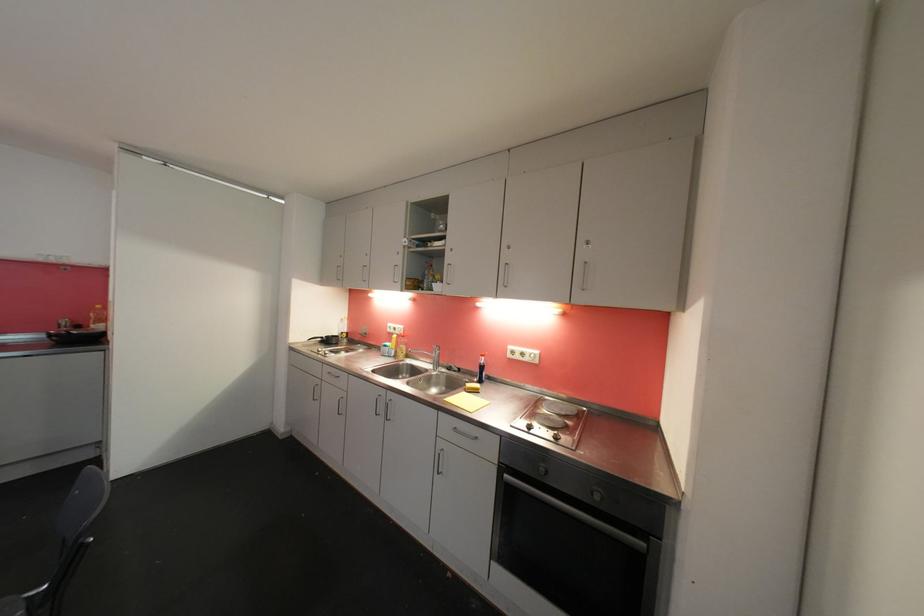
Find where to lift the dark sauce bottle. Please return your answer as a coordinate pair (x, y).

(480, 368)